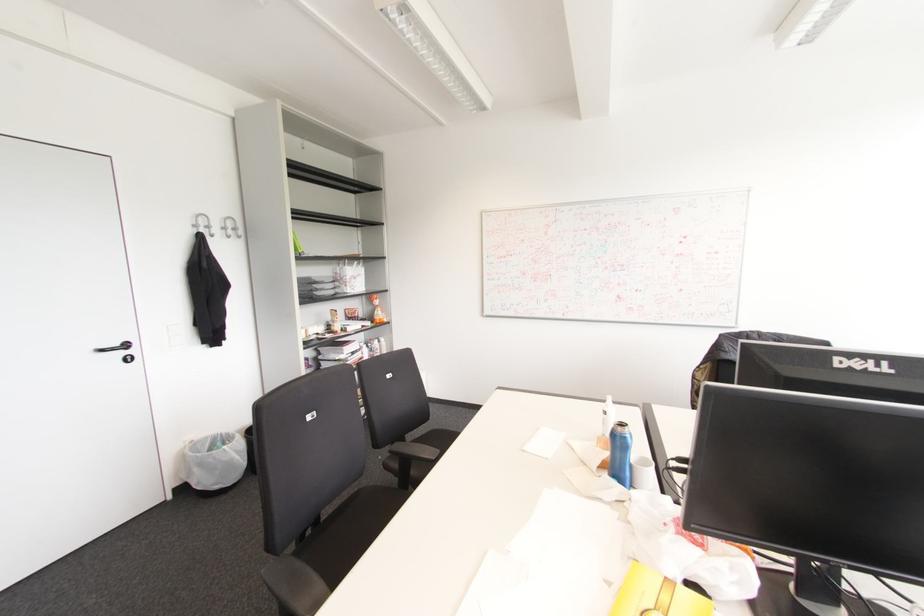
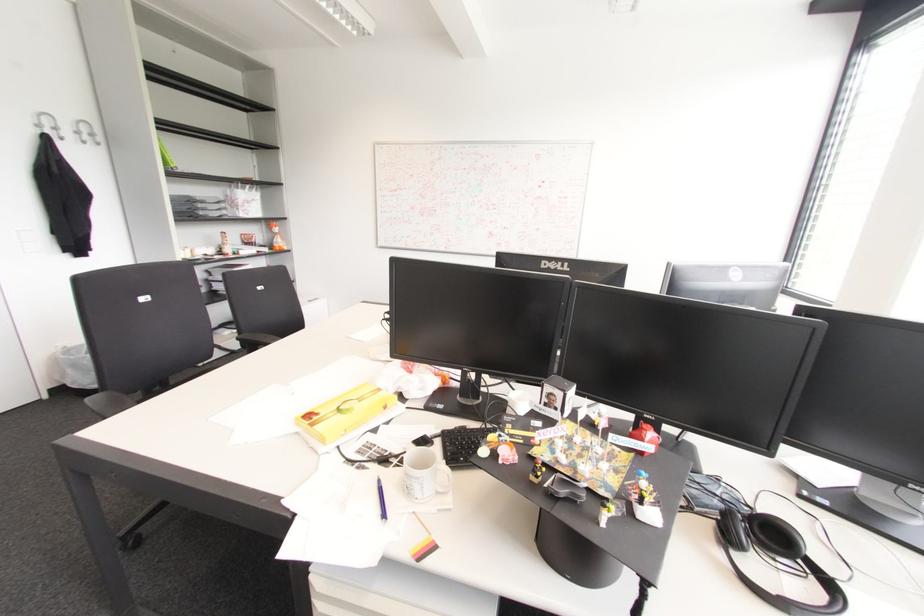
Question: The first image is from the beginning of the video and the second image is from the end. How did the camera likely rotate when shooting the video?

Choices:
 (A) Left
 (B) Right
 (C) Up
 (D) Down

Answer: (B)